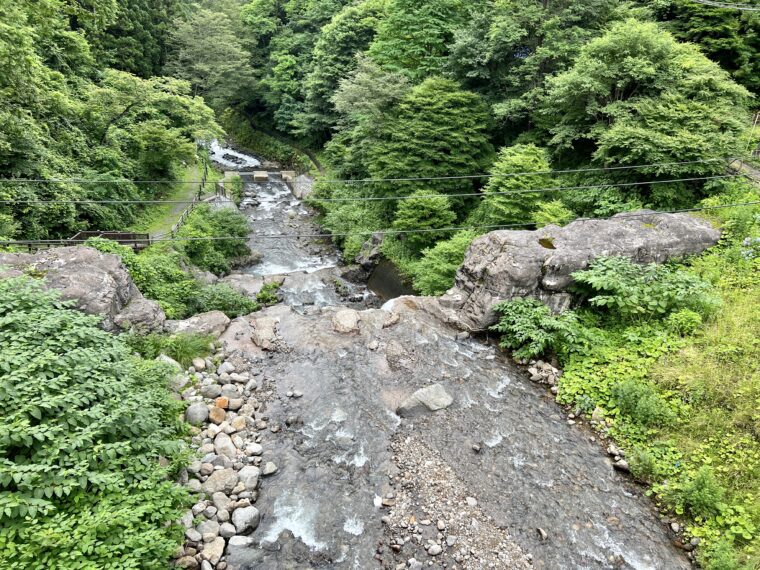
Where is `cables`? The image size is (760, 570). cables is located at coordinates (340, 178), (346, 198), (350, 235).